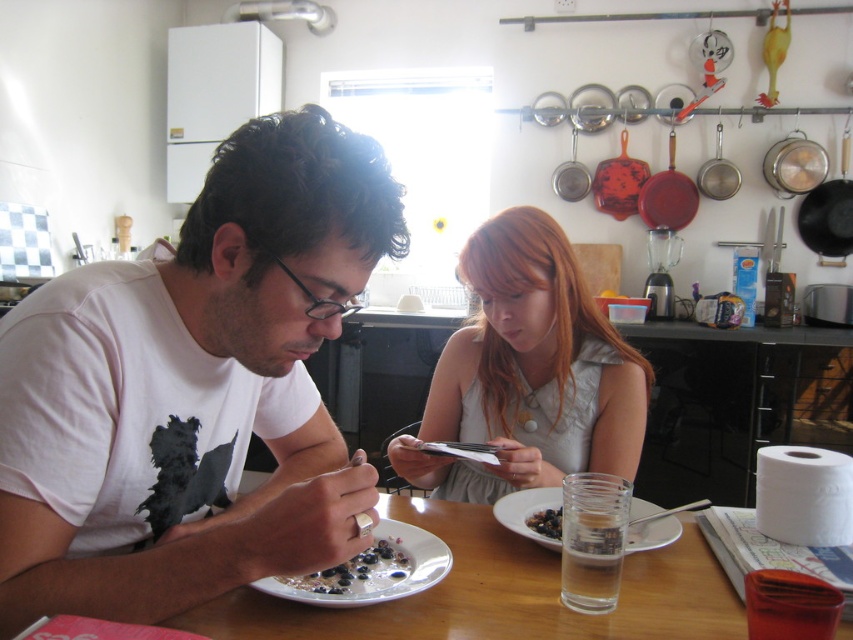
Question: Can you confirm if white glossy plate at lower center is positioned to the left of shiny metallic plate with blueberries at center?

Choices:
 (A) no
 (B) yes

Answer: (A)

Question: Does light gray fabric dress at center have a larger size compared to shiny metallic plate with blueberries at center?

Choices:
 (A) no
 (B) yes

Answer: (B)

Question: Estimate the real-world distances between objects in this image. Which object is farther from the light gray fabric dress at center?

Choices:
 (A) wooden table at center
 (B) shiny metallic plate with blueberries at center
 (C) translucent glass at center
 (D) white glossy plate at lower center

Answer: (B)

Question: Which of the following is the closest to the observer?

Choices:
 (A) (666, 625)
 (B) (537, 243)

Answer: (A)

Question: Which object appears farthest from the camera in this image?

Choices:
 (A) white glossy plate at lower center
 (B) wooden table at center
 (C) white matte t-shirt at center
 (D) light gray fabric dress at center

Answer: (D)

Question: Can you confirm if light gray fabric dress at center is wider than translucent glass at center?

Choices:
 (A) no
 (B) yes

Answer: (B)